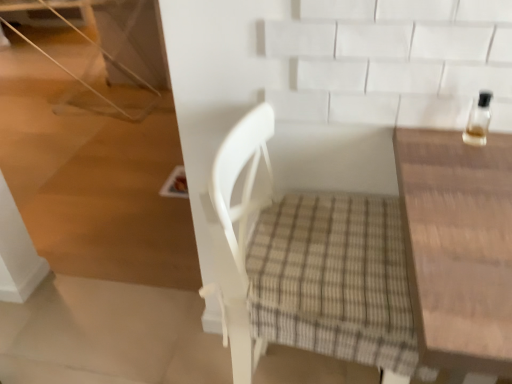
Question: Does clear glass bottle at upper right have a lesser height compared to wooden table at right?

Choices:
 (A) no
 (B) yes

Answer: (B)

Question: From a real-world perspective, is clear glass bottle at upper right positioned over wooden table at right based on gravity?

Choices:
 (A) no
 (B) yes

Answer: (B)

Question: Is clear glass bottle at upper right turned away from wooden table at right?

Choices:
 (A) no
 (B) yes

Answer: (A)

Question: Is clear glass bottle at upper right positioned far away from wooden table at right?

Choices:
 (A) yes
 (B) no

Answer: (B)

Question: Is clear glass bottle at upper right completely or partially outside of wooden table at right?

Choices:
 (A) yes
 (B) no

Answer: (A)

Question: Is clear glass bottle at upper right spatially inside white woven chair at center, or outside of it?

Choices:
 (A) outside
 (B) inside

Answer: (A)

Question: Considering the positions of clear glass bottle at upper right and white woven chair at center in the image, is clear glass bottle at upper right wider or thinner than white woven chair at center?

Choices:
 (A) thin
 (B) wide

Answer: (A)

Question: From the image's perspective, is clear glass bottle at upper right located above or below white woven chair at center?

Choices:
 (A) above
 (B) below

Answer: (A)

Question: In the image, is clear glass bottle at upper right on the left side or the right side of white woven chair at center?

Choices:
 (A) right
 (B) left

Answer: (A)

Question: In terms of width, does wooden table at right look wider or thinner when compared to white woven chair at center?

Choices:
 (A) wide
 (B) thin

Answer: (A)

Question: From a real-world perspective, relative to white woven chair at center, is wooden table at right vertically above or below?

Choices:
 (A) below
 (B) above

Answer: (A)

Question: Considering their positions, is wooden table at right located in front of or behind white woven chair at center?

Choices:
 (A) behind
 (B) front

Answer: (B)

Question: Based on their positions, is wooden table at right located to the left or right of white woven chair at center?

Choices:
 (A) right
 (B) left

Answer: (A)

Question: From the image's perspective, relative to clear glass bottle at upper right, is white woven chair at center above or below?

Choices:
 (A) above
 (B) below

Answer: (B)

Question: Is white woven chair at center taller or shorter than clear glass bottle at upper right?

Choices:
 (A) short
 (B) tall

Answer: (B)